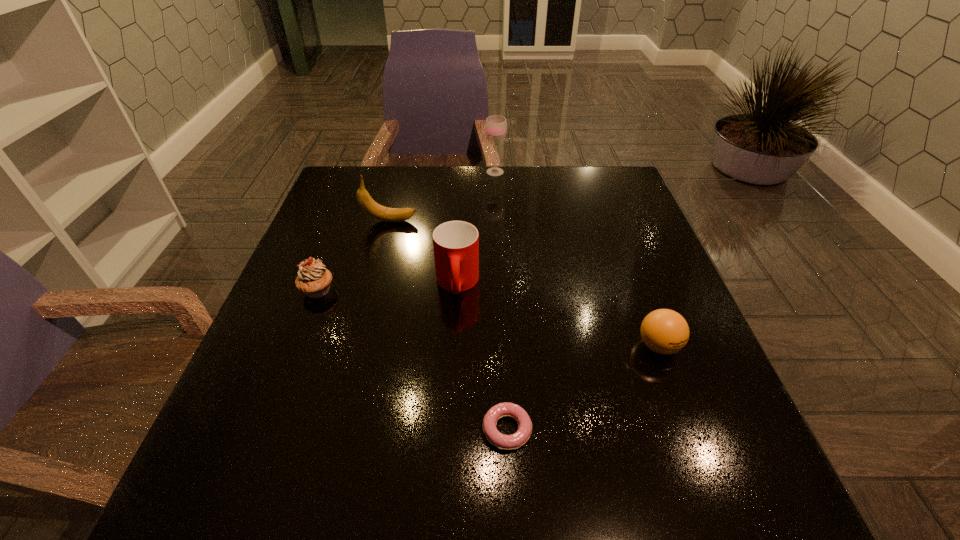
Locate an element on the screen. The height and width of the screenshot is (540, 960). vacant space situated 0.350m at the start of the peel on the second farthest object is located at coordinates (549, 221).

Where is `free region located 0.290m on the side of the cup with the handle`? This screenshot has width=960, height=540. free region located 0.290m on the side of the cup with the handle is located at coordinates (449, 434).

Where is `vacant space situated 0.370m on the right of the leftmost object`? The width and height of the screenshot is (960, 540). vacant space situated 0.370m on the right of the leftmost object is located at coordinates (502, 290).

The height and width of the screenshot is (540, 960). I want to click on vacant space situated on the side with brand of the ping-pong ball, so click(x=698, y=451).

Identify the location of vacant space located 0.250m on the back of the nearest object. This screenshot has height=540, width=960. (501, 303).

Find the location of a particular element. The height and width of the screenshot is (540, 960). object that is positioned at the far edge is located at coordinates (496, 126).

Find the location of `banana that is positioned at the left edge`. banana that is positioned at the left edge is located at coordinates (380, 212).

I want to click on cupcake at the left edge, so click(313, 279).

Locate an element on the screen. This screenshot has height=540, width=960. object that is at the right edge is located at coordinates (664, 331).

Identify the location of vacant space at the far edge of the desktop. The width and height of the screenshot is (960, 540). (434, 199).